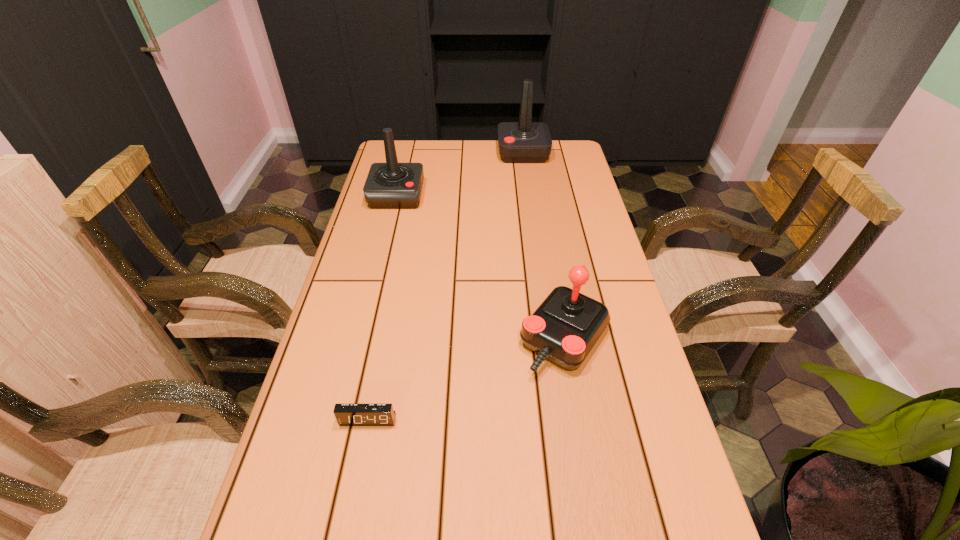
Locate an element on the screen. object present at the far edge is located at coordinates (525, 141).

Locate an element on the screen. Image resolution: width=960 pixels, height=540 pixels. joystick that is at the left edge is located at coordinates (391, 185).

You are a GUI agent. You are given a task and a screenshot of the screen. Output one action in this format:
    pyautogui.click(x=<x>, y=<y>)
    Task: Click on the alarm clock that is at the left edge
    This screenshot has height=540, width=960.
    Given the screenshot: What is the action you would take?
    pyautogui.click(x=346, y=414)

The height and width of the screenshot is (540, 960). Find the location of `object at the far right corner`. object at the far right corner is located at coordinates (525, 141).

Locate an element on the screen. The height and width of the screenshot is (540, 960). free space at the far edge of the desktop is located at coordinates (424, 165).

I want to click on free space at the left edge, so click(x=366, y=389).

Identify the location of vacant region at the right edge. coord(585,179).

Find the location of a particular element. The height and width of the screenshot is (540, 960). vacant space at the far right corner is located at coordinates (559, 153).

Find the location of a particular element. This screenshot has height=540, width=960. free space between the farthest joystick and the leftmost joystick is located at coordinates (460, 174).

Where is `free space between the second farthest joystick and the farthest joystick`? free space between the second farthest joystick and the farthest joystick is located at coordinates (460, 174).